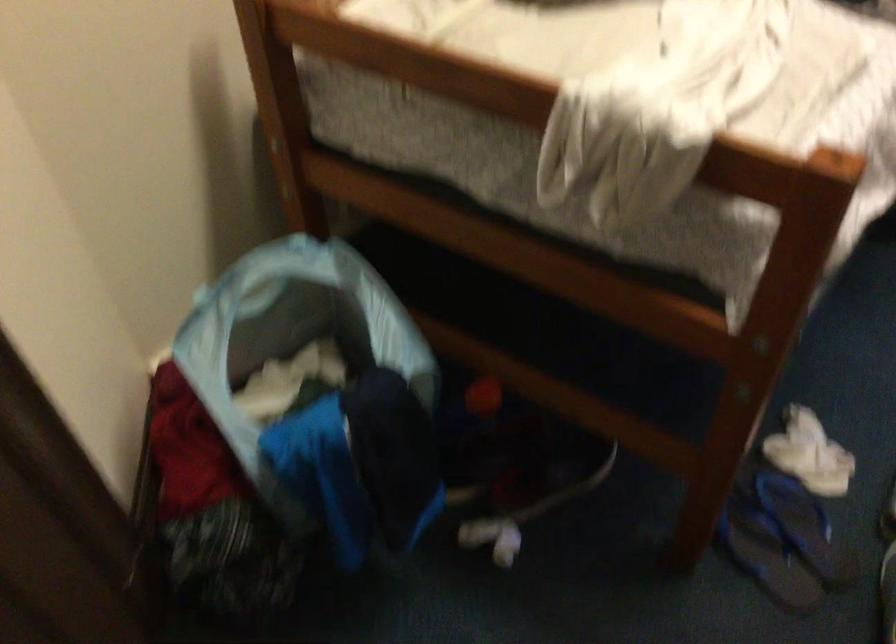
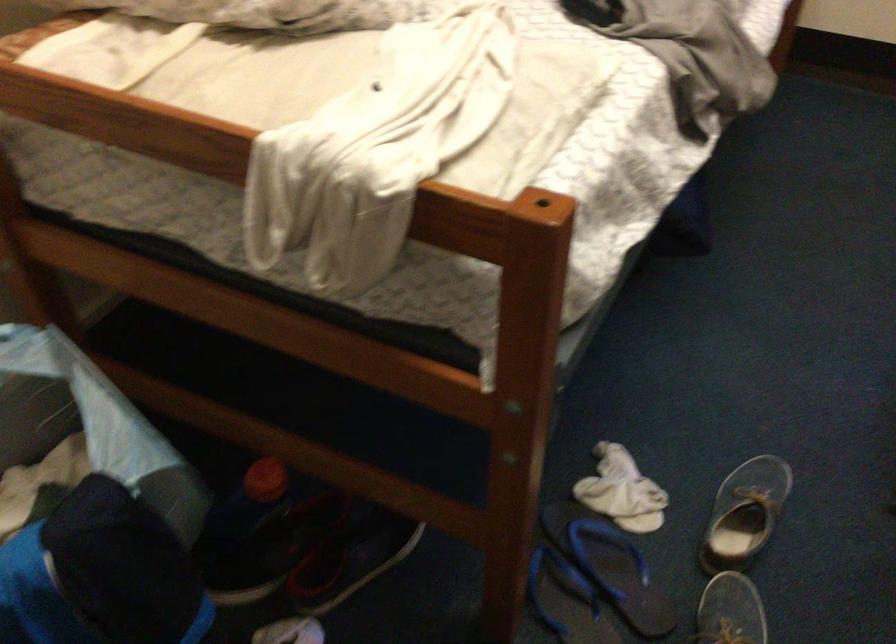
Where in the second image is the point corresponding to (483,401) from the first image?

(264, 480)